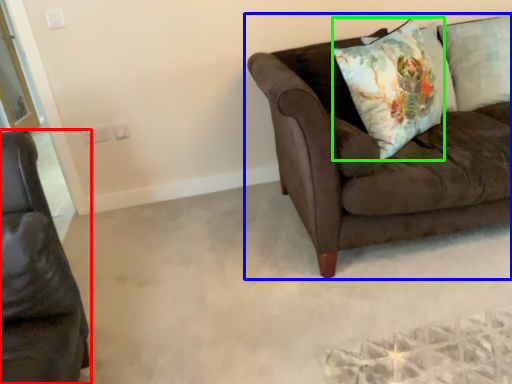
Question: Estimate the real-world distances between objects in this image. Which object is farther from studio couch (highlighted by a red box), studio couch (highlighted by a blue box) or throw pillow (highlighted by a green box)?

Choices:
 (A) studio couch
 (B) throw pillow

Answer: (B)